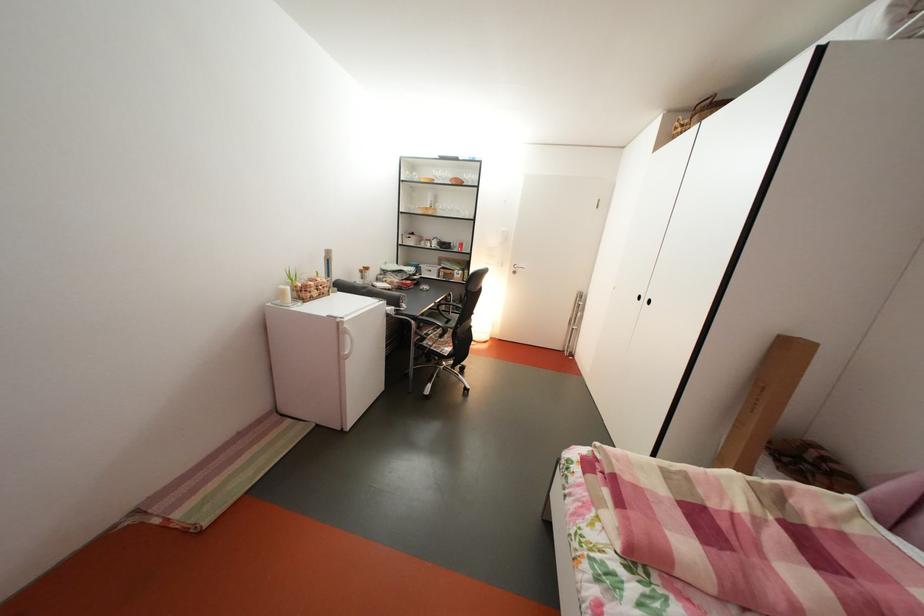
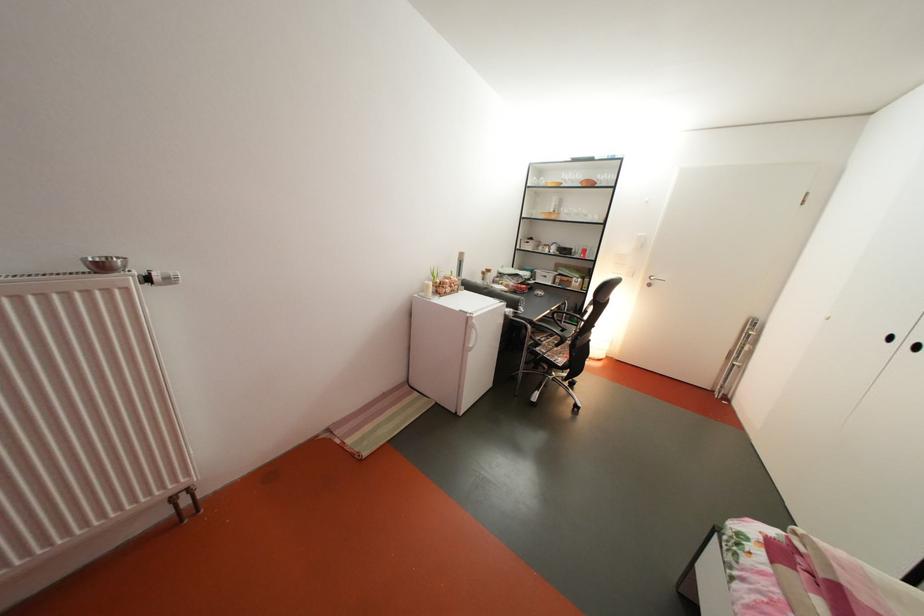
Locate, in the second image, the point that corresponds to (x=469, y=217) in the first image.

(598, 222)